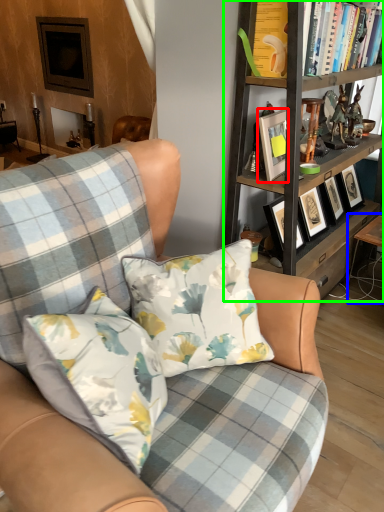
Question: Based on their relative distances, which object is farther from picture frame (highlighted by a red box)? Choose from table (highlighted by a blue box) and bookcase (highlighted by a green box).

Choices:
 (A) table
 (B) bookcase

Answer: (A)